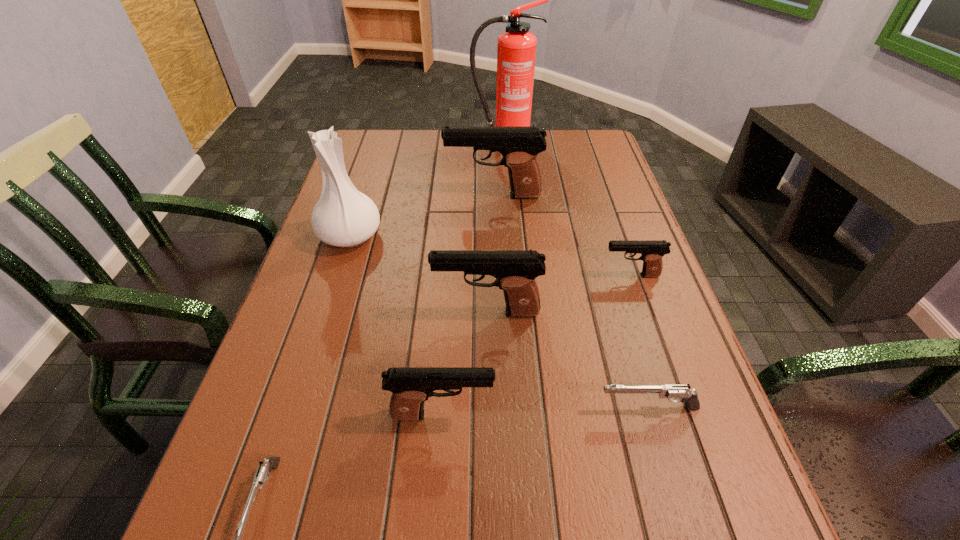
You are a GUI agent. You are given a task and a screenshot of the screen. Output one action in this format:
    pyautogui.click(x=<x>, y=<y>)
    Task: Click on the tallest object
    
    Given the screenshot: What is the action you would take?
    pyautogui.click(x=516, y=52)

Image resolution: width=960 pixels, height=540 pixels. What are the coordinates of `the farthest object` in the screenshot? It's located at (516, 52).

The width and height of the screenshot is (960, 540). I want to click on vase, so click(344, 217).

Where is `white vase`? white vase is located at coordinates (344, 217).

Locate an element on the screen. the second farthest object is located at coordinates (519, 146).

In order to click on the third tallest object in this screenshot , I will do `click(519, 146)`.

Locate an element on the screen. The width and height of the screenshot is (960, 540). the third farthest black pistol is located at coordinates (515, 271).

This screenshot has height=540, width=960. I want to click on the third smallest black pistol, so click(x=515, y=271).

Find the location of a particular element. The height and width of the screenshot is (540, 960). the second smallest black pistol is located at coordinates (411, 386).

Locate an element on the screen. This screenshot has height=540, width=960. the fifth tallest object is located at coordinates (411, 386).